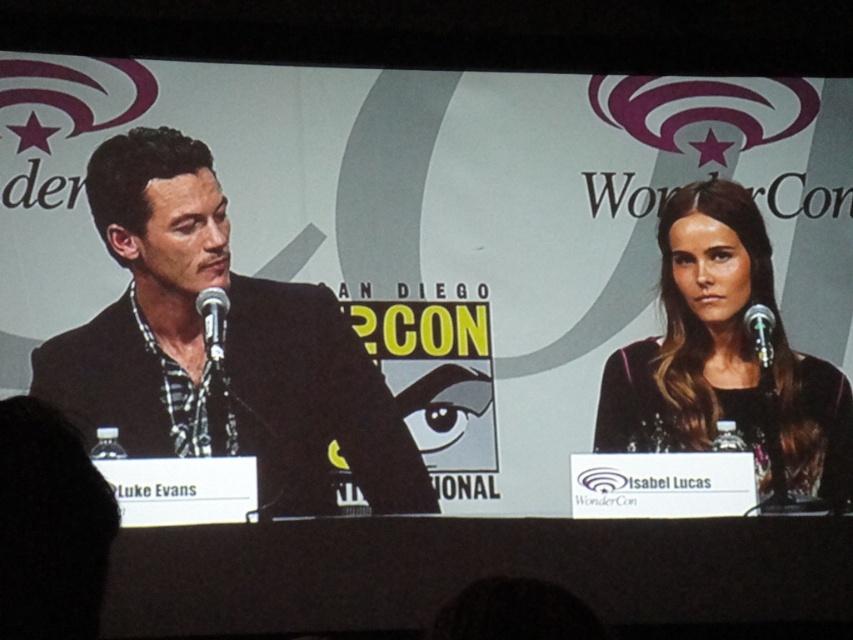
You are an event coordinator at WonderCon in San Diego. You need to ensure that the black textured suit at left and the silver metallic microphone at right are visible to the audience. Given their sizes, which object should you place closer to the front of the stage to maintain visibility?

The black textured suit at left is larger than the silver metallic microphone at right. To ensure both objects are visible, the silver metallic microphone at right should be placed closer to the front of the stage so it remains visible alongside the larger suit.

You are attending WonderCon in San Diego and are sitting in the front row facing the panel discussion. You notice the black textured suit at left and the black metallic microphone at left. Which object is positioned closer to you?

The black textured suit at left is closer to the viewer than the black metallic microphone at left.

You are a photographer at WonderCon in San Diego, and you need to capture a closeup shot of the black sequined dress at right. Based on the scene description, is the dress within a reasonable distance for a closeup shot?

The black sequined dress at right is 84.13 meters away from camera, which is too far for a closeup shot. A closeup typically requires the subject to be within a few meters, so the dress is not within a reasonable distance.